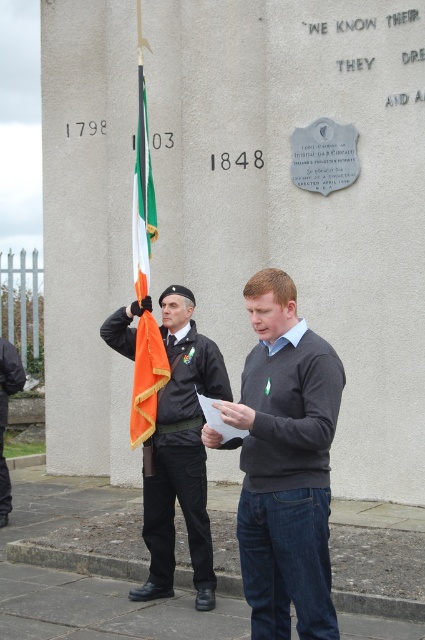
Question: Does dark gray sweater at center appear over orange fabric flag at center?

Choices:
 (A) yes
 (B) no

Answer: (B)

Question: Which object is closer to the camera taking this photo?

Choices:
 (A) dark gray sweater at center
 (B) dark gray uniform at center

Answer: (A)

Question: Among these points, which one is farthest from the camera?

Choices:
 (A) [x=311, y=560]
 (B) [x=172, y=554]
 (C) [x=161, y=348]
 (D) [x=138, y=269]

Answer: (D)

Question: Considering the real-world distances, which object is farthest from the orange fabric flag at center?

Choices:
 (A) irish flag at center
 (B) dark gray sweater at center
 (C) dark gray uniform at center

Answer: (B)

Question: Does dark gray sweater at center come in front of matte black uniform at center?

Choices:
 (A) yes
 (B) no

Answer: (A)

Question: Does matte black uniform at center have a greater width compared to irish flag at center?

Choices:
 (A) yes
 (B) no

Answer: (A)